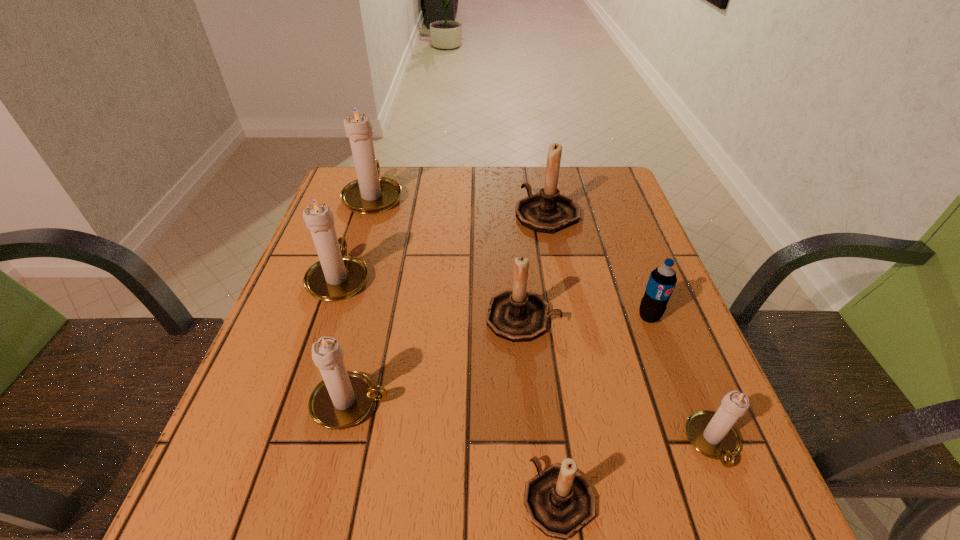
At what (x,y) coordinates should I click in order to perform the action: click on blank space located on the front of the biggest brown candle holder. Please return your answer as a coordinate pair (x, y). This screenshot has height=540, width=960. Looking at the image, I should click on (554, 250).

You are a GUI agent. You are given a task and a screenshot of the screen. Output one action in this format:
    pyautogui.click(x=<x>, y=<y>)
    Task: Click on the vacant space located on the handle side of the third smallest white candle holder
    
    Given the screenshot: What is the action you would take?
    pyautogui.click(x=365, y=201)

Identify the location of vacant area situated on the handle side of the third smallest white candle holder. Image resolution: width=960 pixels, height=540 pixels. (374, 173).

The height and width of the screenshot is (540, 960). I want to click on free spot located on the handle side of the third smallest white candle holder, so click(x=374, y=173).

Locate an element on the screen. vacant space located 0.320m on the back of the second farthest brown candle holder is located at coordinates (513, 208).

This screenshot has height=540, width=960. What are the coordinates of `free space located on the handle side of the third biggest white candle holder` in the screenshot? It's located at (x=623, y=403).

What are the coordinates of `free point located on the front of the soda bottle` in the screenshot? It's located at [x=732, y=537].

What are the coordinates of `free space located on the handle side of the rightmost white candle holder` in the screenshot? It's located at (752, 539).

Locate an element on the screen. The width and height of the screenshot is (960, 540). soda bottle situated at the right edge is located at coordinates (662, 280).

Locate an element on the screen. This screenshot has height=540, width=960. object that is at the far left corner is located at coordinates (370, 194).